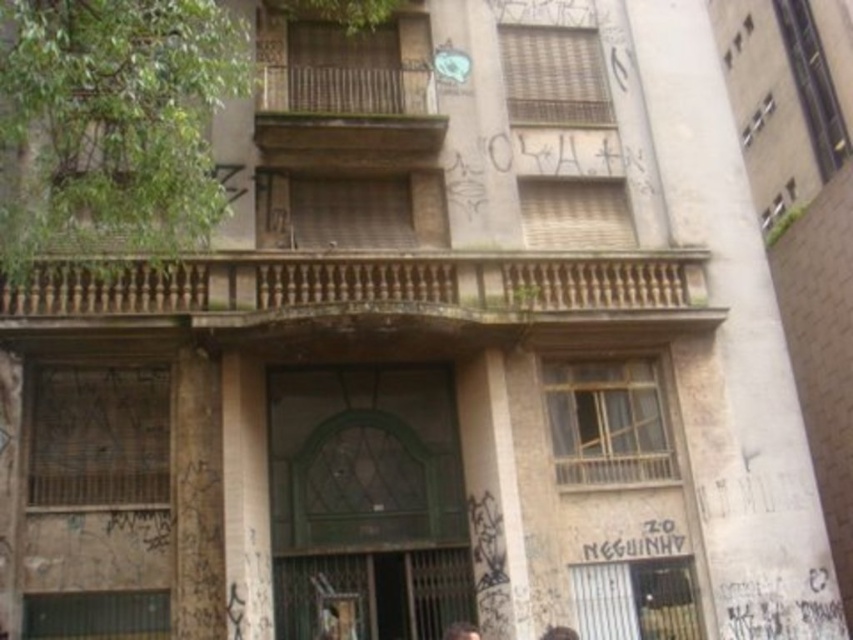
Question: Which of the following is the farthest from the observer?

Choices:
 (A) (262, 417)
 (B) (451, 625)
 (C) (180, 620)

Answer: (A)

Question: In this image, where is smooth concrete pillar at right located relative to dark brown hair at lower center?

Choices:
 (A) right
 (B) left

Answer: (A)

Question: Which of the following is the farthest from the observer?

Choices:
 (A) click(x=173, y=552)
 (B) click(x=698, y=81)
 (C) click(x=262, y=412)

Answer: (B)

Question: Considering the real-world distances, which object is closest to the rusty concrete pillar at center?

Choices:
 (A) dark brown hair at lower center
 (B) smooth concrete pillar at right

Answer: (A)

Question: Is the position of brown wood pillar at center more distant than that of dark brown hair at lower center?

Choices:
 (A) yes
 (B) no

Answer: (A)

Question: Can you confirm if rusty concrete pillar at center is positioned below dark brown hair at lower center?

Choices:
 (A) no
 (B) yes

Answer: (A)